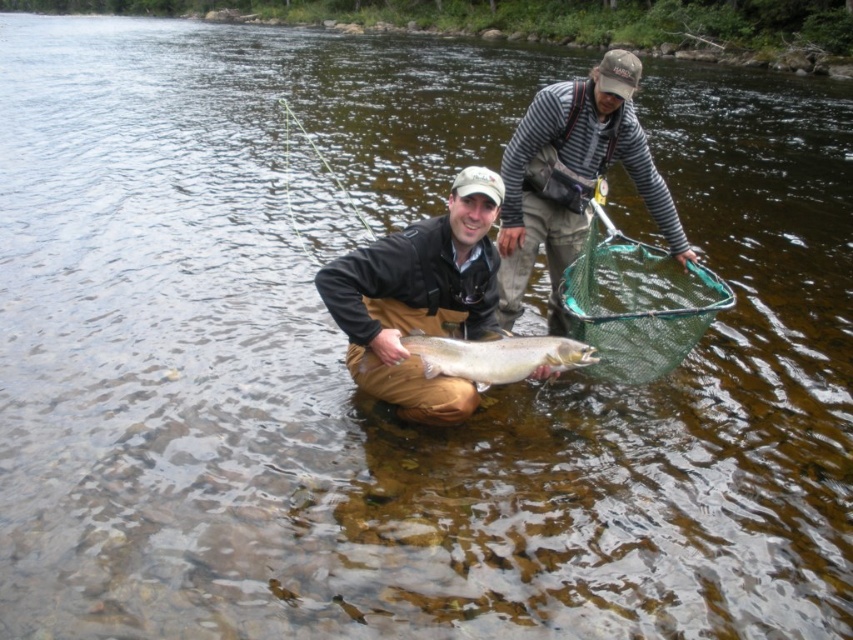
Is matte brown waders at center shorter than shiny silver fish at center?

In fact, matte brown waders at center may be taller than shiny silver fish at center.

Who is taller, matte brown waders at center or shiny silver fish at center?

With more height is matte brown waders at center.

Is point (363, 381) positioned before point (437, 355)?

No, it is not.

What are the coordinates of `matte brown waders at center` in the screenshot? It's located at (421, 300).

Who is shorter, matte brown waders at center or striped long-sleeve shirt at upper right?

Standing shorter between the two is striped long-sleeve shirt at upper right.

Is matte brown waders at center to the left of striped long-sleeve shirt at upper right from the viewer's perspective?

Yes, matte brown waders at center is to the left of striped long-sleeve shirt at upper right.

Is point (412, 396) positioned after point (566, 160)?

No.

Where is `matte brown waders at center`? matte brown waders at center is located at coordinates (421, 300).

Is striped long-sleeve shirt at upper right closer to camera compared to shiny silver fish at center?

No, striped long-sleeve shirt at upper right is further to the viewer.

Who is taller, striped long-sleeve shirt at upper right or shiny silver fish at center?

Standing taller between the two is striped long-sleeve shirt at upper right.

Who is more distant from viewer, (x=664, y=216) or (x=529, y=355)?

Point (x=664, y=216)

The width and height of the screenshot is (853, 640). What are the coordinates of `striped long-sleeve shirt at upper right` in the screenshot? It's located at (572, 177).